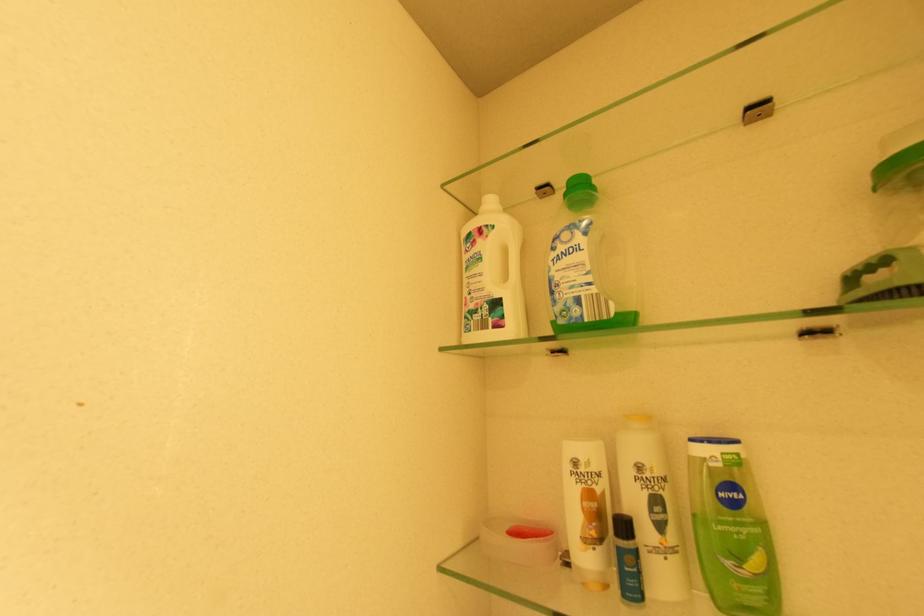
Find where to lift the red container lid. Please return your answer as a coordinate pair (x, y).

(529, 532)